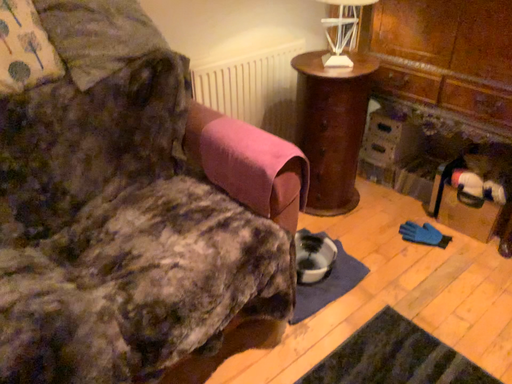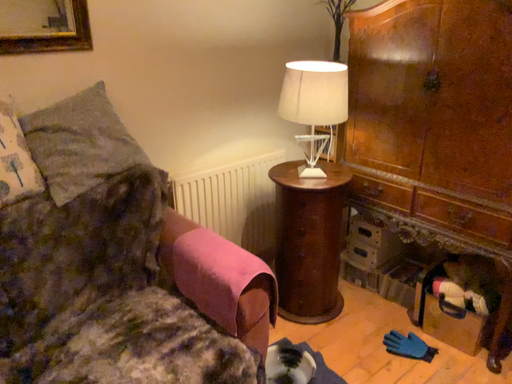
Question: How did the camera likely rotate when shooting the video?

Choices:
 (A) rotated downward
 (B) rotated upward

Answer: (B)